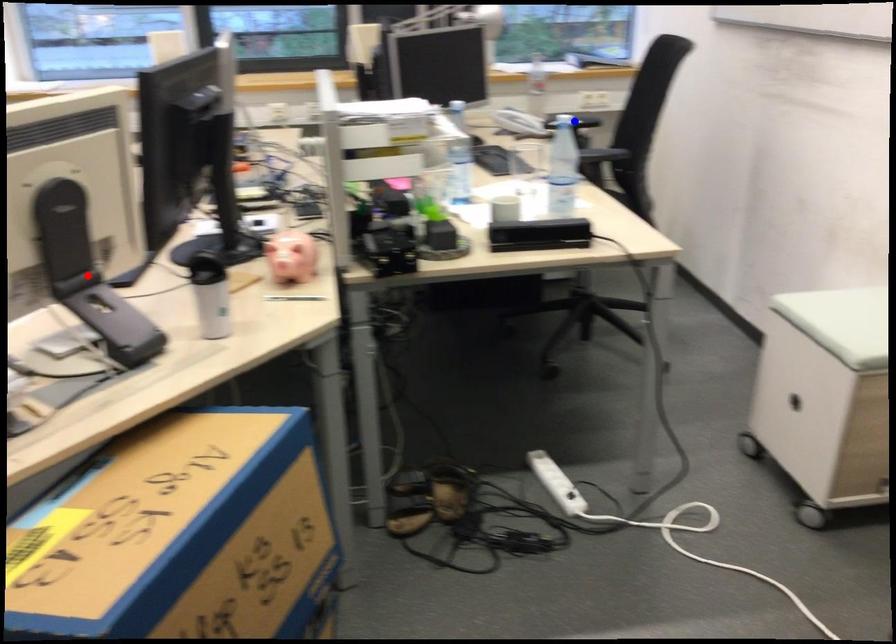
Question: Which of the two points in the image is closer to the camera?

Choices:
 (A) Blue point is closer.
 (B) Red point is closer.

Answer: (B)